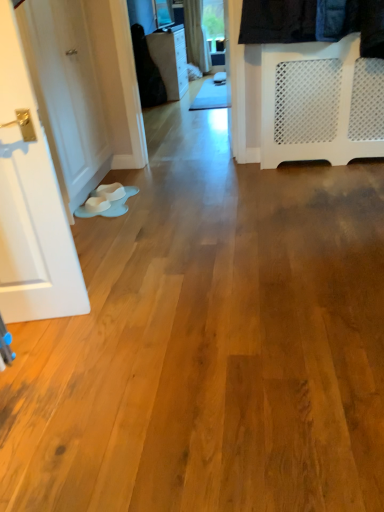
Question: Is white painted wood door at left wider or thinner than matte black dresser at upper center?

Choices:
 (A) thin
 (B) wide

Answer: (A)

Question: Which is correct: white painted wood door at left is inside matte black dresser at upper center, or outside of it?

Choices:
 (A) inside
 (B) outside

Answer: (B)

Question: Estimate the real-world distances between objects in this image. Which object is farther from the white painted wood door at left?

Choices:
 (A) black fabric at upper left
 (B) white mesh gate at right
 (C) matte black dresser at upper center

Answer: (C)

Question: Estimate the real-world distances between objects in this image. Which object is closer to the matte black dresser at upper center?

Choices:
 (A) white mesh gate at right
 (B) white painted wood door at left
 (C) black fabric at upper left

Answer: (C)